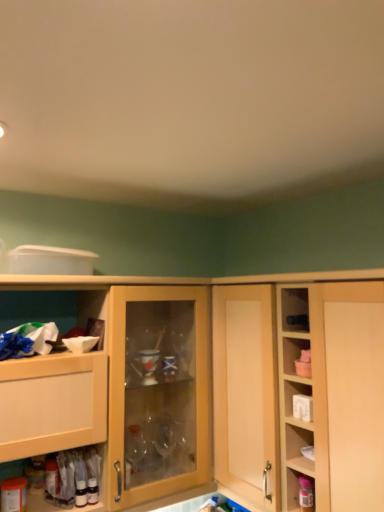
Question: Does light wood cabinet at left, placed as the 2th cabinetry when sorted from right to left, appear on the left side of light wood cabinet at center, arranged as the first cabinetry when viewed from the right?

Choices:
 (A) yes
 (B) no

Answer: (A)

Question: Is light wood cabinet at left, the 1th cabinetry viewed from the left, not near light wood cabinet at center, arranged as the first cabinetry when viewed from the right?

Choices:
 (A) yes
 (B) no

Answer: (B)

Question: Is light wood cabinet at left, the 1th cabinetry viewed from the left, shorter than light wood cabinet at center, arranged as the first cabinetry when viewed from the right?

Choices:
 (A) yes
 (B) no

Answer: (B)

Question: Is light wood cabinet at left, the 1th cabinetry viewed from the left, positioned beyond the bounds of light wood cabinet at center, arranged as the first cabinetry when viewed from the right?

Choices:
 (A) no
 (B) yes

Answer: (B)

Question: Could light wood cabinet at center, which is the 2th cabinetry in left-to-right order, be considered to be inside light wood cabinet at left, placed as the 2th cabinetry when sorted from right to left?

Choices:
 (A) yes
 (B) no

Answer: (B)

Question: Considering the relative sizes of light wood cabinet at left, the 1th cabinetry viewed from the left, and light wood cabinet at center, arranged as the first cabinetry when viewed from the right, in the image provided, is light wood cabinet at left, the 1th cabinetry viewed from the left, taller than light wood cabinet at center, arranged as the first cabinetry when viewed from the right,?

Choices:
 (A) no
 (B) yes

Answer: (A)

Question: Is matte plastic container at lower right far away from light wood cabinet at left, placed as the 2th cabinetry when sorted from right to left?

Choices:
 (A) yes
 (B) no

Answer: (B)

Question: Considering the relative positions of matte plastic container at lower right and light wood cabinet at left, placed as the 2th cabinetry when sorted from right to left, in the image provided, is matte plastic container at lower right to the right of light wood cabinet at left, placed as the 2th cabinetry when sorted from right to left, from the viewer's perspective?

Choices:
 (A) yes
 (B) no

Answer: (A)

Question: Is matte plastic container at lower right next to light wood cabinet at left, the 1th cabinetry viewed from the left?

Choices:
 (A) yes
 (B) no

Answer: (B)

Question: Does matte plastic container at lower right come in front of light wood cabinet at left, placed as the 2th cabinetry when sorted from right to left?

Choices:
 (A) no
 (B) yes

Answer: (A)

Question: Would you say matte plastic container at lower right is outside light wood cabinet at left, the 1th cabinetry viewed from the left?

Choices:
 (A) yes
 (B) no

Answer: (A)

Question: Does matte plastic container at lower right have a lesser height compared to light wood cabinet at left, placed as the 2th cabinetry when sorted from right to left?

Choices:
 (A) yes
 (B) no

Answer: (A)

Question: Can you confirm if matte plastic container at lower right is shorter than white plastic plug at upper right?

Choices:
 (A) no
 (B) yes

Answer: (A)